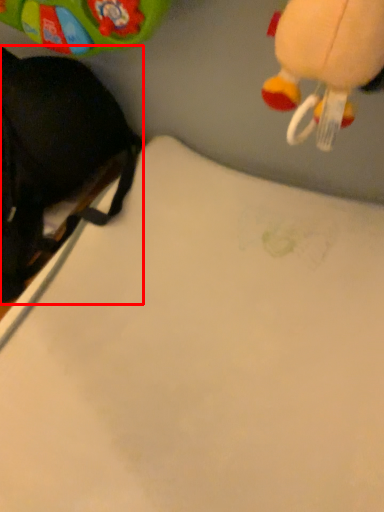
Question: Considering the relative positions of toy (annotated by the red box) and sheet in the image provided, where is toy (annotated by the red box) located with respect to the staircase?

Choices:
 (A) right
 (B) left

Answer: (B)